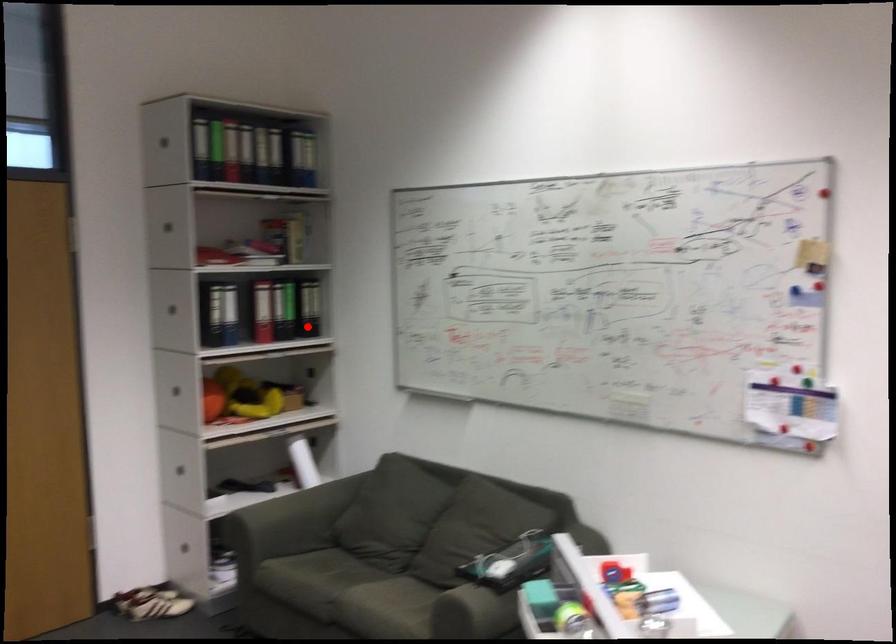
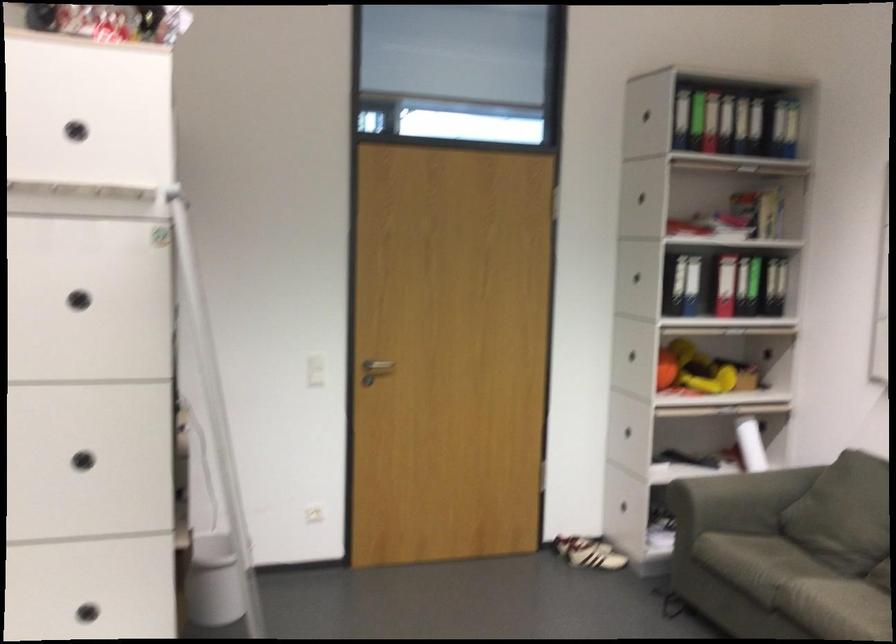
The point at the highlighted location is marked in the first image. Where is the corresponding point in the second image?

(773, 286)